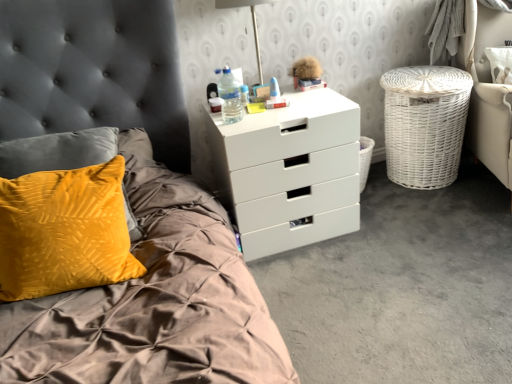
Locate an element on the screen. free space in front of white wicker laundry basket at right is located at coordinates (421, 210).